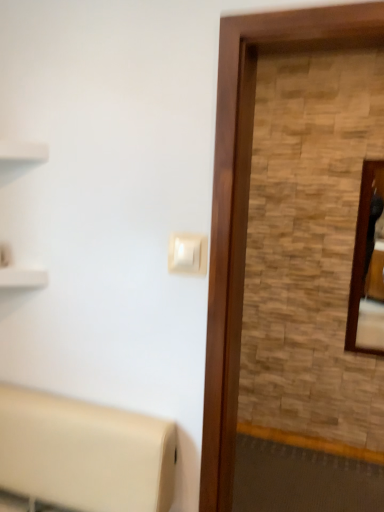
Question: Is wooden frame mirror at right located outside wooden screen door at right?

Choices:
 (A) no
 (B) yes

Answer: (B)

Question: From the image's perspective, is wooden frame mirror at right beneath wooden screen door at right?

Choices:
 (A) no
 (B) yes

Answer: (A)

Question: Is wooden frame mirror at right at the left side of wooden screen door at right?

Choices:
 (A) yes
 (B) no

Answer: (B)

Question: Is wooden frame mirror at right taller than wooden screen door at right?

Choices:
 (A) yes
 (B) no

Answer: (B)

Question: Is wooden screen door at right at the back of wooden frame mirror at right?

Choices:
 (A) yes
 (B) no

Answer: (B)

Question: Does wooden frame mirror at right turn towards wooden screen door at right?

Choices:
 (A) no
 (B) yes

Answer: (B)

Question: Is there a large distance between wooden frame mirror at right and white plastic light switch at center?

Choices:
 (A) yes
 (B) no

Answer: (A)

Question: From the image's perspective, does wooden frame mirror at right appear higher than white plastic light switch at center?

Choices:
 (A) no
 (B) yes

Answer: (A)

Question: Is wooden frame mirror at right positioned with its back to white plastic light switch at center?

Choices:
 (A) yes
 (B) no

Answer: (B)

Question: Does wooden frame mirror at right have a greater height compared to white plastic light switch at center?

Choices:
 (A) yes
 (B) no

Answer: (A)

Question: Is wooden frame mirror at right positioned beyond the bounds of white plastic light switch at center?

Choices:
 (A) no
 (B) yes

Answer: (B)

Question: Is wooden frame mirror at right at the right side of white plastic light switch at center?

Choices:
 (A) no
 (B) yes

Answer: (B)

Question: Would you consider wooden screen door at right to be distant from wooden frame mirror at right?

Choices:
 (A) yes
 (B) no

Answer: (A)